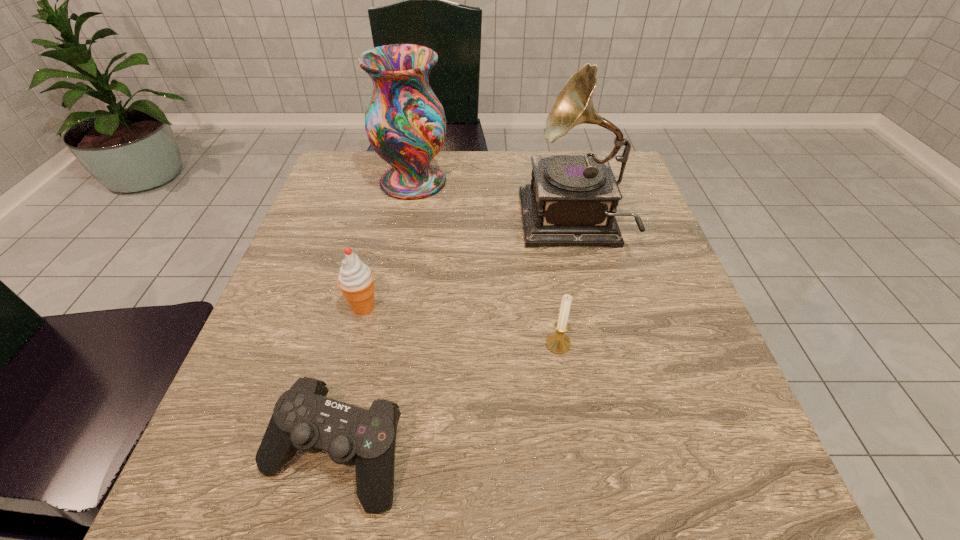
The image size is (960, 540). I want to click on free space at the far right corner of the desktop, so click(578, 151).

Where is `free space between the record player and the third tallest object`? Image resolution: width=960 pixels, height=540 pixels. free space between the record player and the third tallest object is located at coordinates (468, 266).

This screenshot has width=960, height=540. I want to click on free space between the record player and the vase, so click(492, 204).

At what (x,y) coordinates should I click in order to perform the action: click on vacant space in between the record player and the fourth tallest object. Please return your answer as a coordinate pair (x, y). This screenshot has width=960, height=540. Looking at the image, I should click on (564, 285).

Where is `free space between the vase and the candle holder`? free space between the vase and the candle holder is located at coordinates (486, 263).

Where is `free spot between the third shortest object and the vase`? free spot between the third shortest object and the vase is located at coordinates (389, 245).

Find the location of `vacant area between the control and the record player`. vacant area between the control and the record player is located at coordinates (452, 340).

The image size is (960, 540). I want to click on free space between the nearest object and the candle holder, so click(445, 400).

Find the location of a particular element. Image resolution: width=960 pixels, height=540 pixels. free spot between the vase and the nearest object is located at coordinates (373, 319).

Find the location of `vacant area that lies between the vase and the shortest object`. vacant area that lies between the vase and the shortest object is located at coordinates (373, 319).